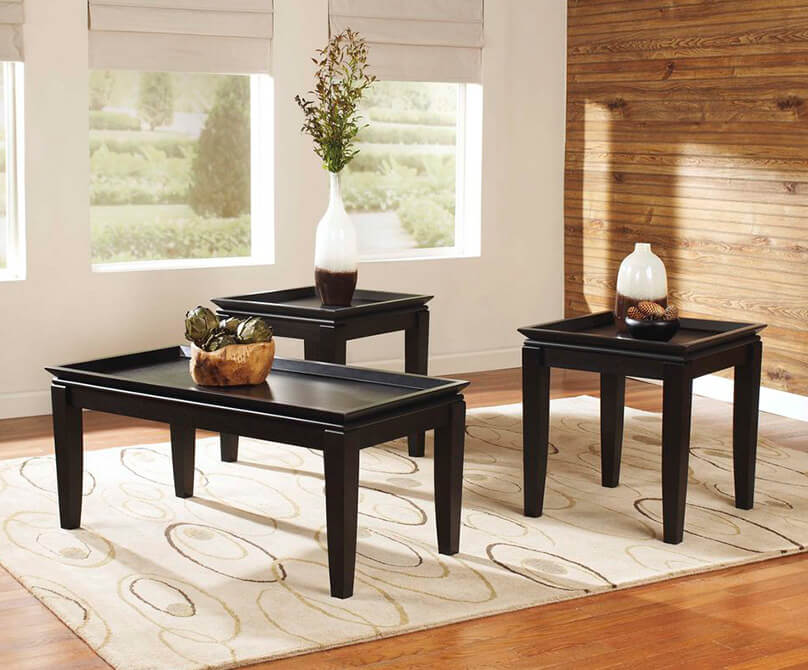
In order to click on vases in this screenshot , I will do `click(343, 246)`, `click(650, 295)`.